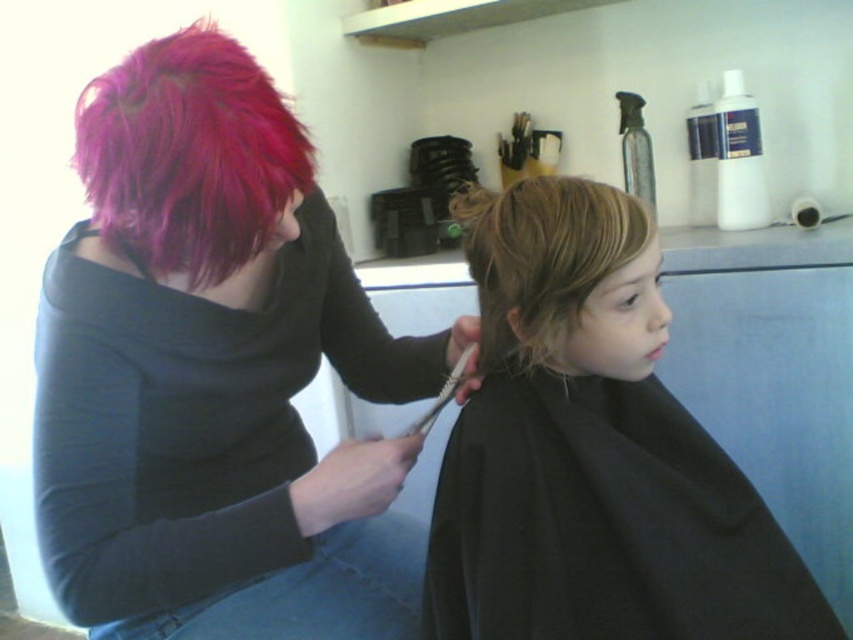
You are a customer in the salon and want to reach both the spray bottle and the container of hair products on the shelf. The spray bottle is at point (178, 228) and the container is at point (428, 412). Which item should you grab first to minimize your reaching distance?

You should grab the spray bottle at point (178, 228) first because it is closer to you than the container of hair products at point (428, 412).

In the scene, there is a point marked at coordinates (213, 372). What object is located at this point?

The point at (213, 372) marks the shiny pink hair at upper left.

You are a customer in the salon and want to know which point is closer to you. The points are labeled as point 1 at position (550,289) and point 2 at position (422,416). Which point is closer to you?

Point 1 at position (550,289) is closer to you than point 2 at position (422,416).